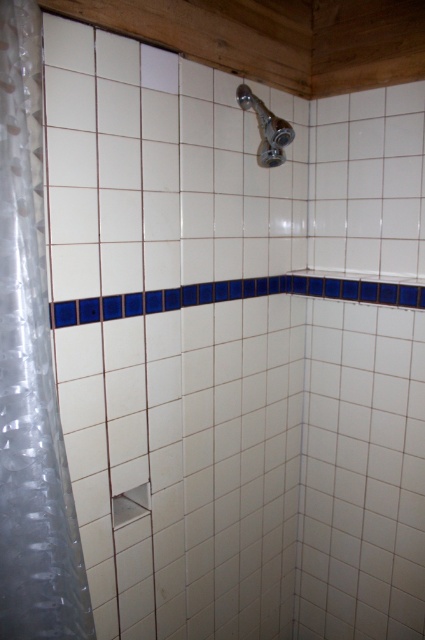
Is clear plastic shower curtain at left taller than satin chrome showerhead at upper center?

Yes, clear plastic shower curtain at left is taller than satin chrome showerhead at upper center.

Measure the distance between clear plastic shower curtain at left and camera.

They are 34.30 inches apart.

Where is `clear plastic shower curtain at left`? The width and height of the screenshot is (425, 640). clear plastic shower curtain at left is located at coordinates (31, 371).